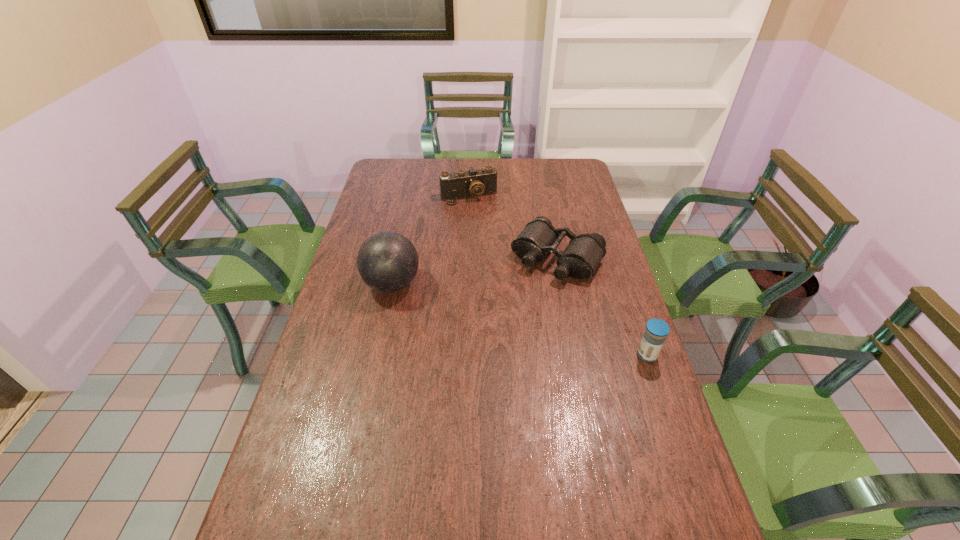
Locate an element on the screen. The width and height of the screenshot is (960, 540). free space between the rightmost object and the leftmost object is located at coordinates (519, 320).

Find the location of a particular element. Image resolution: width=960 pixels, height=540 pixels. vacant space that is in between the leftmost object and the camera is located at coordinates (430, 240).

Find the location of a particular element. The height and width of the screenshot is (540, 960). unoccupied position between the third object from right to left and the leftmost object is located at coordinates (430, 240).

Locate an element on the screen. the third closest object relative to the shortest object is located at coordinates (387, 261).

Find the location of `object that is the second nearest to the medicine`. object that is the second nearest to the medicine is located at coordinates (x=387, y=261).

This screenshot has height=540, width=960. In order to click on free spot that satisfies the following two spatial constraints: 1. on the front side of the binoculars; 2. on the left side of the nearest object in this screenshot , I will do `click(577, 355)`.